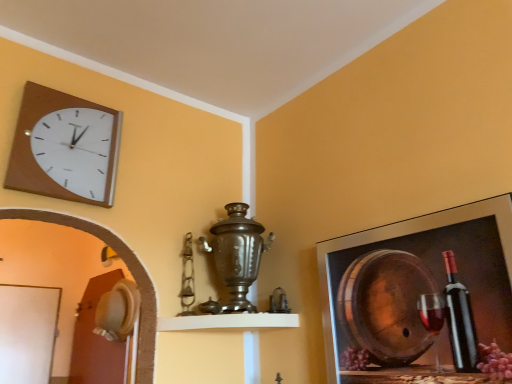
What are the coordinates of `white matte shelf at center` in the screenshot? It's located at (228, 322).

Find the location of a particular element. matte brown clock at upper left is located at coordinates (65, 147).

The width and height of the screenshot is (512, 384). What are the coordinates of `metallic frame at upper right` in the screenshot? It's located at (417, 294).

Is matte brown clock at upper left turned away from metallic frame at upper right?

No.

In terms of width, does matte brown clock at upper left look wider or thinner when compared to metallic frame at upper right?

Clearly, matte brown clock at upper left has less width compared to metallic frame at upper right.

Can you confirm if matte brown clock at upper left is taller than metallic frame at upper right?

In fact, matte brown clock at upper left may be shorter than metallic frame at upper right.

Would you say matte brown clock at upper left is inside or outside metallic frame at upper right?

matte brown clock at upper left is located beyond the bounds of metallic frame at upper right.

From a real-world perspective, which object rests below the other?

From a 3D spatial view, white matte shelf at center is below.

Between point (390, 374) and point (264, 327), which one is positioned in front?

Positioned in front is point (390, 374).

Based on their sizes in the image, would you say metallic frame at upper right is bigger or smaller than white matte shelf at center?

Clearly, metallic frame at upper right is larger in size than white matte shelf at center.

Is metallic frame at upper right located outside white matte shelf at center?

Yes.

From the image's perspective, is white matte shelf at center on metallic frame at upper right?

Actually, white matte shelf at center appears below metallic frame at upper right in the image.

Is white matte shelf at center bigger or smaller than metallic frame at upper right?

Clearly, white matte shelf at center is smaller in size than metallic frame at upper right.

Is white matte shelf at center positioned behind metallic frame at upper right?

Yes, white matte shelf at center is further from the camera.

Is white matte shelf at center at the right side of metallic frame at upper right?

In fact, white matte shelf at center is to the left of metallic frame at upper right.

Does point (22, 124) come in front of point (228, 327)?

Yes.

Is matte brown clock at upper left wider than white matte shelf at center?

In fact, matte brown clock at upper left might be narrower than white matte shelf at center.

Which of these two, matte brown clock at upper left or white matte shelf at center, is smaller?

matte brown clock at upper left is smaller.

There is a white matte shelf at center. Find the location of `wall clock above it (from a real-world perspective)`. wall clock above it (from a real-world perspective) is located at coordinates (65, 147).

Is white matte shelf at center wider or thinner than matte brown clock at upper left?

Clearly, white matte shelf at center has more width compared to matte brown clock at upper left.

From their relative heights in the image, would you say white matte shelf at center is taller or shorter than matte brown clock at upper left?

Considering their sizes, white matte shelf at center has less height than matte brown clock at upper left.

Is white matte shelf at center to the right of matte brown clock at upper left from the viewer's perspective?

Correct, you'll find white matte shelf at center to the right of matte brown clock at upper left.

Can you tell me how much white matte shelf at center and matte brown clock at upper left differ in facing direction?

0.924 degrees.

Based on the photo, can you tell me how much metallic frame at upper right and matte brown clock at upper left differ in facing direction?

88.9 degrees.

Can you confirm if metallic frame at upper right is shorter than matte brown clock at upper left?

Incorrect, the height of metallic frame at upper right does not fall short of that of matte brown clock at upper left.

The image size is (512, 384). Find the location of `wall clock above the metallic frame at upper right (from a real-world perspective)`. wall clock above the metallic frame at upper right (from a real-world perspective) is located at coordinates (65, 147).

Does metallic frame at upper right have a greater width compared to matte brown clock at upper left?

Correct, the width of metallic frame at upper right exceeds that of matte brown clock at upper left.

Find the location of a particular element. This screenshot has height=384, width=512. wall clock on the left of metallic frame at upper right is located at coordinates (65, 147).

Find the location of a particular element. The image size is (512, 384). picture frame above the white matte shelf at center (from a real-world perspective) is located at coordinates (417, 294).

Based on their spatial positions, is white matte shelf at center or matte brown clock at upper left closer to metallic frame at upper right?

Based on the image, white matte shelf at center appears to be nearer to metallic frame at upper right.

From the image, which object appears to be nearer to white matte shelf at center, metallic frame at upper right or matte brown clock at upper left?

metallic frame at upper right is closer to white matte shelf at center.

Considering their positions, is matte brown clock at upper left positioned further to white matte shelf at center than metallic frame at upper right?

matte brown clock at upper left.

Based on their spatial positions, is matte brown clock at upper left or white matte shelf at center closer to metallic frame at upper right?

white matte shelf at center lies closer to metallic frame at upper right than the other object.

From the image, which object appears to be farther from matte brown clock at upper left, metallic frame at upper right or white matte shelf at center?

metallic frame at upper right is further to matte brown clock at upper left.

Which object lies further to the anchor point matte brown clock at upper left, white matte shelf at center or metallic frame at upper right?

metallic frame at upper right is positioned further to the anchor matte brown clock at upper left.

This screenshot has height=384, width=512. Identify the location of shelf between matte brown clock at upper left and metallic frame at upper right from left to right. (228, 322).